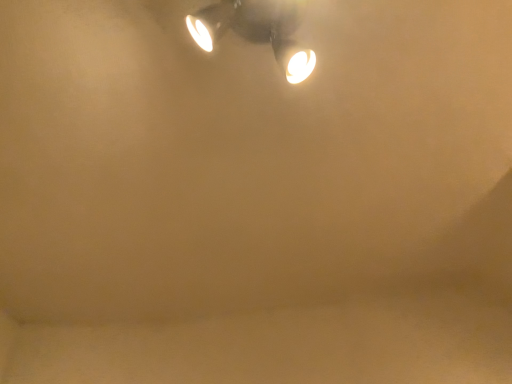
Question: Should I look upward or downward to see matte black lamp at upper center?

Choices:
 (A) down
 (B) up

Answer: (B)